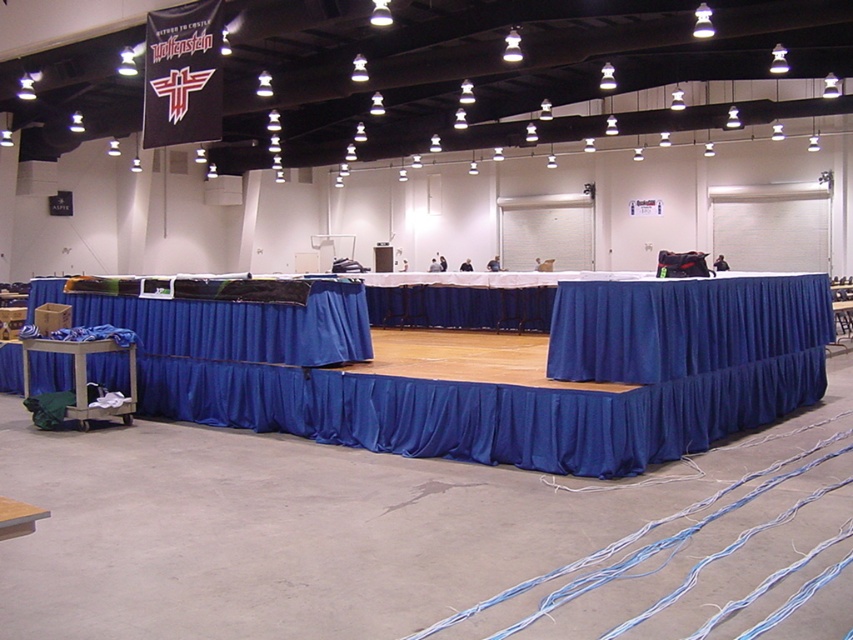
Question: Is blue fabric tablecloth at left positioned behind green fabric cart at lower left?

Choices:
 (A) yes
 (B) no

Answer: (B)

Question: Can you confirm if blue fabric tablecloth at left is positioned to the right of green fabric cart at lower left?

Choices:
 (A) yes
 (B) no

Answer: (A)

Question: Among these points, which one is farthest from the camera?

Choices:
 (A) coord(125,317)
 (B) coord(44,342)

Answer: (A)

Question: Which point is farther from the camera taking this photo?

Choices:
 (A) (38, 339)
 (B) (167, 316)

Answer: (B)

Question: Does blue fabric tablecloth at left have a lesser width compared to green fabric cart at lower left?

Choices:
 (A) yes
 (B) no

Answer: (B)

Question: Which of the following is the farthest from the observer?

Choices:
 (A) (169, 310)
 (B) (93, 353)

Answer: (A)